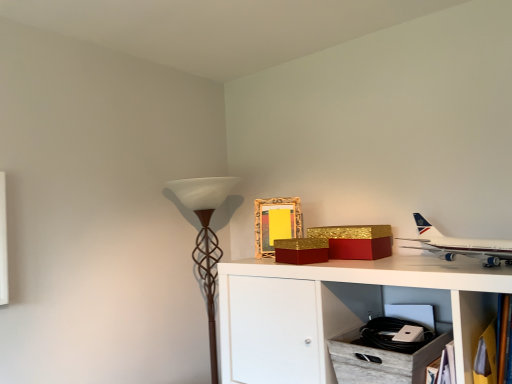
What do you see at coordinates (276, 223) in the screenshot? This screenshot has height=384, width=512. I see `gold textured picture frame at upper center` at bounding box center [276, 223].

Identify the location of gold textured picture frame at upper center. (276, 223).

Identify the location of brown textured floor lamp at left. The height and width of the screenshot is (384, 512). (205, 240).

What do you see at coordinates (381, 360) in the screenshot?
I see `wooden crate at lower center` at bounding box center [381, 360].

What do you see at coordinates (460, 245) in the screenshot? I see `white glossy airplane at upper right` at bounding box center [460, 245].

I want to click on wooden bookshelf at lower right, so click(470, 327).

Find the location of a particular element. The height and width of the screenshot is (384, 512). gold textured picture frame at upper center is located at coordinates (276, 223).

Do you think brown textured floor lamp at left is within gold glittery box at upper center, which ranks as the 1th box in left-to-right order, or outside of it?

brown textured floor lamp at left is located beyond the bounds of gold glittery box at upper center, which ranks as the 1th box in left-to-right order.

From a real-world perspective, is brown textured floor lamp at left located beneath gold glittery box at upper center, the second box viewed from the right?

Yes, from a real-world perspective, brown textured floor lamp at left is under gold glittery box at upper center, the second box viewed from the right.

Is brown textured floor lamp at left aimed at gold glittery box at upper center, the second box viewed from the right?

No, brown textured floor lamp at left is not facing towards gold glittery box at upper center, the second box viewed from the right.

Considering the sizes of objects brown textured floor lamp at left and gold glittery box at upper center, the second box viewed from the right, in the image provided, who is taller, brown textured floor lamp at left or gold glittery box at upper center, the second box viewed from the right,?

Standing taller between the two is brown textured floor lamp at left.

Would you say gold textured box at upper center, which is the 1th box from right to left, is inside or outside gold glittery box at upper center, which ranks as the 1th box in left-to-right order?

gold textured box at upper center, which is the 1th box from right to left, cannot be found inside gold glittery box at upper center, which ranks as the 1th box in left-to-right order.

Considering the sizes of gold textured box at upper center, the 2th box in the left-to-right sequence, and gold glittery box at upper center, which ranks as the 1th box in left-to-right order, in the image, is gold textured box at upper center, the 2th box in the left-to-right sequence, wider or thinner than gold glittery box at upper center, which ranks as the 1th box in left-to-right order,?

Considering their sizes, gold textured box at upper center, the 2th box in the left-to-right sequence, looks broader than gold glittery box at upper center, which ranks as the 1th box in left-to-right order.

Are gold textured box at upper center, the 2th box in the left-to-right sequence, and gold glittery box at upper center, the second box viewed from the right, beside each other?

Yes.

Considering the relative sizes of brown textured floor lamp at left and wooden crate at lower center in the image provided, is brown textured floor lamp at left smaller than wooden crate at lower center?

Incorrect, brown textured floor lamp at left is not smaller in size than wooden crate at lower center.

You are a GUI agent. You are given a task and a screenshot of the screen. Output one action in this format:
    pyautogui.click(x=<x>, y=<y>)
    Task: Click on the table lamp on the left of wooden crate at lower center
    The image size is (512, 384).
    Given the screenshot: What is the action you would take?
    pyautogui.click(x=205, y=240)

Is brown textured floor lamp at left completely or partially outside of wooden crate at lower center?

That's correct, brown textured floor lamp at left is outside of wooden crate at lower center.

Is point (180, 195) positioned before point (336, 247)?

No, (180, 195) is further to viewer.

Who is more distant, brown textured floor lamp at left or gold textured box at upper center, the 2th box in the left-to-right sequence?

brown textured floor lamp at left is further from the camera.

In the scene shown: Which object is wider, brown textured floor lamp at left or gold textured box at upper center, the 2th box in the left-to-right sequence?

brown textured floor lamp at left is wider.

Can you tell me how much wooden bookshelf at lower right and brown textured floor lamp at left differ in facing direction?

The facing directions of wooden bookshelf at lower right and brown textured floor lamp at left are 0.394 degrees apart.

Is wooden bookshelf at lower right with brown textured floor lamp at left?

There is a gap between wooden bookshelf at lower right and brown textured floor lamp at left.

Is wooden bookshelf at lower right looking in the opposite direction of brown textured floor lamp at left?

No, brown textured floor lamp at left is not at the back of wooden bookshelf at lower right.

Is wooden bookshelf at lower right positioned beyond the bounds of brown textured floor lamp at left?

wooden bookshelf at lower right is positioned outside brown textured floor lamp at left.

Between gold glittery box at upper center, the second box viewed from the right, and gold textured box at upper center, which is the 1th box from right to left, which one has more height?

With more height is gold textured box at upper center, which is the 1th box from right to left.

Which is closer, (317, 253) or (344, 257)?

Point (317, 253) is closer to the camera than point (344, 257).

Does gold glittery box at upper center, the second box viewed from the right, contain gold textured box at upper center, the 2th box in the left-to-right sequence?

No, gold textured box at upper center, the 2th box in the left-to-right sequence, is not surrounded by gold glittery box at upper center, the second box viewed from the right.

Considering the positions of point (187, 198) and point (485, 298), is point (187, 198) closer or farther from the camera than point (485, 298)?

Clearly, point (187, 198) is more distant from the camera than point (485, 298).

Does brown textured floor lamp at left turn towards wooden bookshelf at lower right?

No, brown textured floor lamp at left is not turned towards wooden bookshelf at lower right.

From the image's perspective, is brown textured floor lamp at left located beneath wooden bookshelf at lower right?

No, from the image's perspective, brown textured floor lamp at left is not beneath wooden bookshelf at lower right.

Find the location of a particular element. The image size is (512, 384). table lamp below the gold glittery box at upper center, which ranks as the 1th box in left-to-right order (from the image's perspective) is located at coordinates (205, 240).

Image resolution: width=512 pixels, height=384 pixels. Identify the location of box that is under the gold textured box at upper center, the 2th box in the left-to-right sequence (from a real-world perspective). (301, 250).

Which object lies further to the anchor point white glossy airplane at upper right, wooden crate at lower center or gold glittery box at upper center, which ranks as the 1th box in left-to-right order?

gold glittery box at upper center, which ranks as the 1th box in left-to-right order, is further to white glossy airplane at upper right.

From the picture: Looking at the image, which one is located further to wooden bookshelf at lower right, gold glittery box at upper center, the second box viewed from the right, or white glossy airplane at upper right?

Among the two, gold glittery box at upper center, the second box viewed from the right, is located further to wooden bookshelf at lower right.

Estimate the real-world distances between objects in this image. Which object is closer to wooden bookshelf at lower right, gold textured picture frame at upper center or wooden crate at lower center?

wooden crate at lower center is positioned closer to the anchor wooden bookshelf at lower right.

Estimate the real-world distances between objects in this image. Which object is further from gold textured picture frame at upper center, gold glittery box at upper center, the second box viewed from the right, or brown textured floor lamp at left?

brown textured floor lamp at left is further to gold textured picture frame at upper center.

Looking at the image, which one is located closer to white glossy airplane at upper right, gold textured box at upper center, which is the 1th box from right to left, or brown textured floor lamp at left?

Based on the image, gold textured box at upper center, which is the 1th box from right to left, appears to be nearer to white glossy airplane at upper right.

From the image, which object appears to be nearer to white glossy airplane at upper right, gold textured box at upper center, the 2th box in the left-to-right sequence, or gold textured picture frame at upper center?

gold textured box at upper center, the 2th box in the left-to-right sequence, lies closer to white glossy airplane at upper right than the other object.

From the image, which object appears to be farther from brown textured floor lamp at left, wooden bookshelf at lower right or gold textured box at upper center, which is the 1th box from right to left?

wooden bookshelf at lower right is further to brown textured floor lamp at left.

Estimate the real-world distances between objects in this image. Which object is further from white glossy airplane at upper right, gold textured picture frame at upper center or wooden bookshelf at lower right?

Among the two, gold textured picture frame at upper center is located further to white glossy airplane at upper right.

You are a GUI agent. You are given a task and a screenshot of the screen. Output one action in this format:
    pyautogui.click(x=<x>, y=<y>)
    Task: Click on the box between white glossy airplane at upper right and gold textured box at upper center, which is the 1th box from right to left, along the z-axis
    The image size is (512, 384).
    Given the screenshot: What is the action you would take?
    tap(301, 250)

Locate an element on the screen. Image resolution: width=512 pixels, height=384 pixels. shelf between gold textured box at upper center, which is the 1th box from right to left, and wooden crate at lower center vertically is located at coordinates (470, 327).

Locate an element on the screen. drawer positioned between wooden bookshelf at lower right and gold textured picture frame at upper center from near to far is located at coordinates (381, 360).

You are a GUI agent. You are given a task and a screenshot of the screen. Output one action in this format:
    pyautogui.click(x=<x>, y=<y>)
    Task: Click on the box between gold glittery box at upper center, which ranks as the 1th box in left-to-right order, and gold textured picture frame at upper center, along the z-axis
    The height and width of the screenshot is (384, 512).
    Given the screenshot: What is the action you would take?
    pyautogui.click(x=356, y=241)